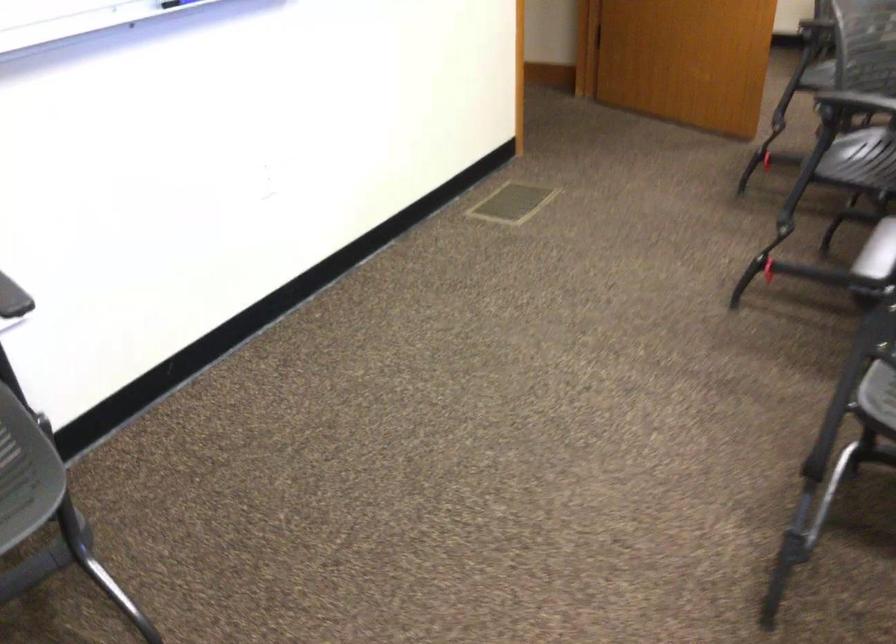
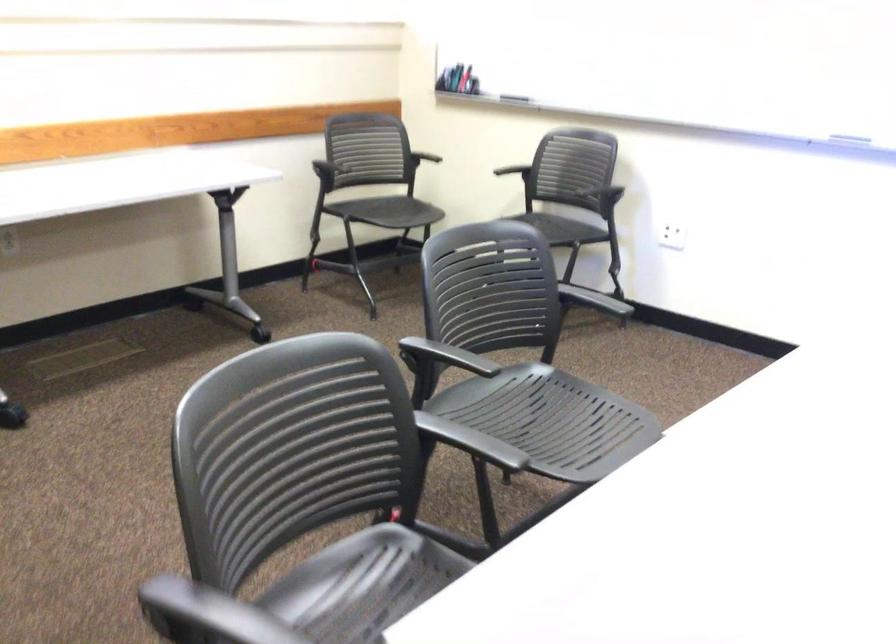
Question: I am providing you with two images of the same scene from different viewpoints. Which of the following objects are not visible in image2?

Choices:
 (A) whiteboard marker
 (B) small window handle
 (C) black chair armrest
 (D) chair sitting surface

Answer: (D)